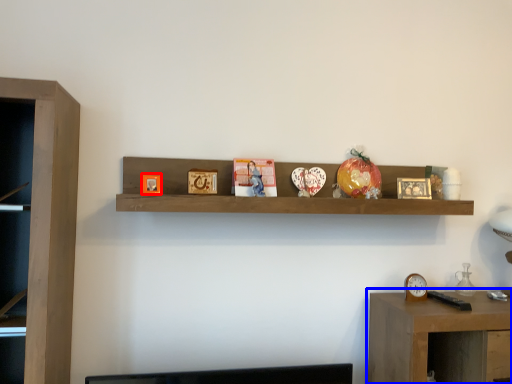
Question: Which object appears farthest to the camera in this image, picture frame (highlighted by a red box) or table (highlighted by a blue box)?

Choices:
 (A) picture frame
 (B) table

Answer: (A)